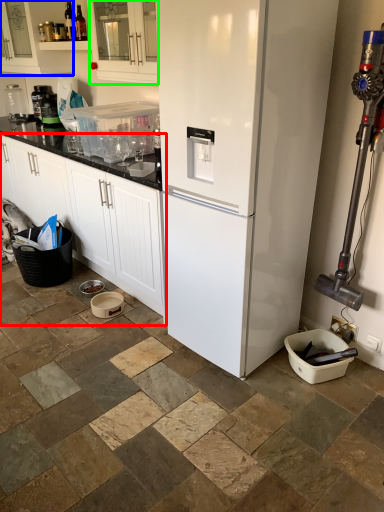
Question: Which is nearer to the cabinetry (highlighted by a red box)? cabinetry (highlighted by a blue box) or cabinetry (highlighted by a green box).

Choices:
 (A) cabinetry
 (B) cabinetry

Answer: (B)